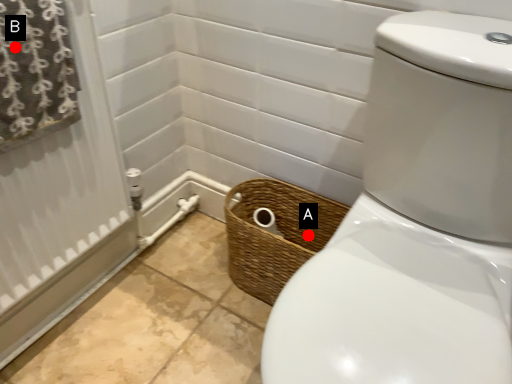
Question: Two points are circled on the image, labeled by A and B beside each circle. Which point is closer to the camera?

Choices:
 (A) A is closer
 (B) B is closer

Answer: (B)